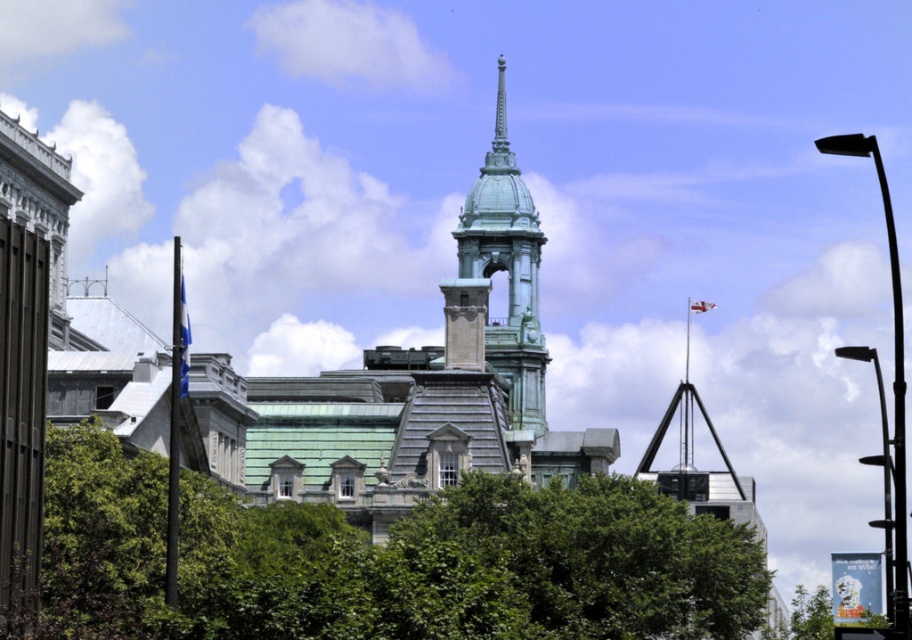
You are a tourist standing in front of the historic building. You want to take a photo of the green patina bell tower at center without any obstructions. Is the green leafy tree at center blocking your view of the tower?

The green leafy tree at center is in front of the green patina bell tower at center, so yes, the tree is blocking the view of the tower.

You are standing at the entrance of the historic building and want to take a photo of the green leafy tree at center. Where should you position yourself to capture the tree in the frame?

Since the green leafy tree at center is located at coordinates approximately 0.877 on the x axis and 0.421 on the y axis, you should position yourself to the right side of the entrance to ensure the tree is centered in your photo.